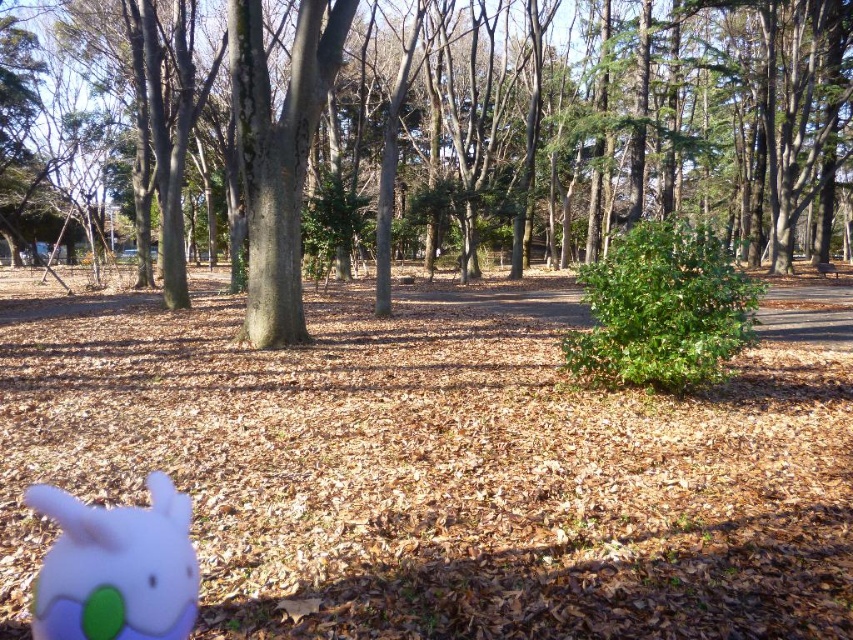
Question: Which of the following is the closest to the observer?

Choices:
 (A) (376, 88)
 (B) (148, 538)

Answer: (B)

Question: Which point is farther to the camera?

Choices:
 (A) (154, 596)
 (B) (231, 188)

Answer: (B)

Question: Which point is closer to the camera?

Choices:
 (A) white matte plush toy at lower left
 (B) brown textured tree at center

Answer: (A)

Question: Where is brown textured tree at center located in relation to white matte plush toy at lower left in the image?

Choices:
 (A) left
 (B) right

Answer: (B)

Question: Is brown textured tree at center above white matte plush toy at lower left?

Choices:
 (A) yes
 (B) no

Answer: (A)

Question: Is brown textured tree at center bigger than white matte plush toy at lower left?

Choices:
 (A) no
 (B) yes

Answer: (B)